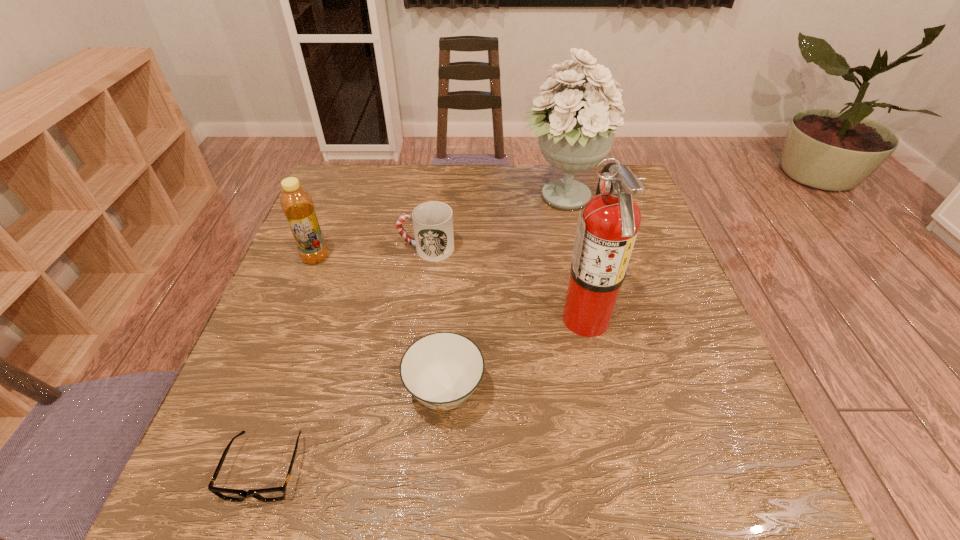
Where is `free spot located 0.220m on the nozzle side of the fire extinguisher`? The image size is (960, 540). free spot located 0.220m on the nozzle side of the fire extinguisher is located at coordinates (463, 318).

Identify the location of vacant position located on the nozzle side of the fire extinguisher. The height and width of the screenshot is (540, 960). (427, 318).

In order to click on vacant space positioned on the right of the bottle in this screenshot , I will do `click(412, 257)`.

Identify the location of vacant area located on the side of the cup where the handle is located. The width and height of the screenshot is (960, 540). (339, 248).

At what (x,y) coordinates should I click in order to perform the action: click on free space located 0.120m on the side of the cup where the handle is located. Please return your answer as a coordinate pair (x, y). This screenshot has width=960, height=540. Looking at the image, I should click on (354, 248).

The height and width of the screenshot is (540, 960). Identify the location of vacant space located on the side of the cup where the handle is located. (350, 248).

I want to click on vacant space located 0.290m on the back of the soup bowl, so click(453, 261).

Find the location of `object that is at the far edge`. object that is at the far edge is located at coordinates (575, 128).

Find the location of a particular element. Image resolution: width=960 pixels, height=540 pixels. object that is at the near edge is located at coordinates 273,494.

The width and height of the screenshot is (960, 540). What are the coordinates of `bottle present at the left edge` in the screenshot? It's located at click(296, 202).